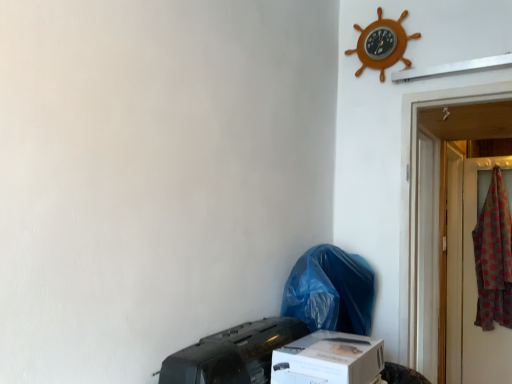
Question: Should I look upward or downward to see wooden ship wheel at upper right?

Choices:
 (A) up
 (B) down

Answer: (A)

Question: From a real-world perspective, is black matte printer at lower center located higher than wooden ship wheel at upper right?

Choices:
 (A) yes
 (B) no

Answer: (B)

Question: Is black matte printer at lower center facing away from wooden ship wheel at upper right?

Choices:
 (A) no
 (B) yes

Answer: (A)

Question: Is black matte printer at lower center at the left side of wooden ship wheel at upper right?

Choices:
 (A) no
 (B) yes

Answer: (B)

Question: Is black matte printer at lower center not inside wooden ship wheel at upper right?

Choices:
 (A) yes
 (B) no

Answer: (A)

Question: Considering the relative sizes of black matte printer at lower center and wooden ship wheel at upper right in the image provided, is black matte printer at lower center thinner than wooden ship wheel at upper right?

Choices:
 (A) yes
 (B) no

Answer: (B)

Question: Does black matte printer at lower center appear on the right side of wooden ship wheel at upper right?

Choices:
 (A) no
 (B) yes

Answer: (A)

Question: Does white cardboard box at lower center have a larger size compared to wooden ship wheel at upper right?

Choices:
 (A) no
 (B) yes

Answer: (B)

Question: From the image's perspective, is white cardboard box at lower center on wooden ship wheel at upper right?

Choices:
 (A) yes
 (B) no

Answer: (B)

Question: Considering the relative sizes of white cardboard box at lower center and wooden ship wheel at upper right in the image provided, is white cardboard box at lower center wider than wooden ship wheel at upper right?

Choices:
 (A) no
 (B) yes

Answer: (B)

Question: From the image's perspective, would you say white cardboard box at lower center is shown under wooden ship wheel at upper right?

Choices:
 (A) yes
 (B) no

Answer: (A)

Question: Is white cardboard box at lower center further to the viewer compared to wooden ship wheel at upper right?

Choices:
 (A) yes
 (B) no

Answer: (B)

Question: Can we say white cardboard box at lower center lies outside wooden ship wheel at upper right?

Choices:
 (A) yes
 (B) no

Answer: (A)

Question: From the image's perspective, does black matte printer at lower center appear lower than blue plastic bag at lower center?

Choices:
 (A) yes
 (B) no

Answer: (A)